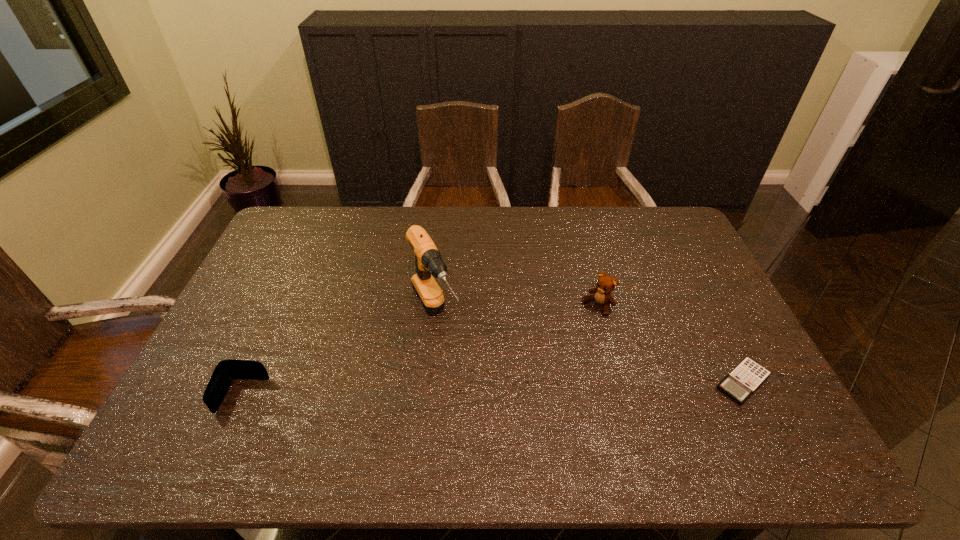
Find the location of a particular element. The image size is (960, 540). vacant area situated 0.070m at the tip of the third object from right to left is located at coordinates (456, 368).

The height and width of the screenshot is (540, 960). Identify the location of blank space located at the tip of the third object from right to left. coord(464,382).

This screenshot has height=540, width=960. In order to click on vacant space located 0.110m on the front-facing side of the teddy bear in this screenshot , I will do `click(567, 334)`.

Where is `vacant region located 0.270m on the front-facing side of the teddy bear`? The image size is (960, 540). vacant region located 0.270m on the front-facing side of the teddy bear is located at coordinates (531, 368).

This screenshot has height=540, width=960. I want to click on free location located 0.380m on the front-facing side of the teddy bear, so click(x=503, y=394).

Image resolution: width=960 pixels, height=540 pixels. What are the coordinates of `wallet that is at the near edge` in the screenshot? It's located at (226, 370).

Where is `calculator situated at the near edge`? The height and width of the screenshot is (540, 960). calculator situated at the near edge is located at coordinates (747, 376).

Find the location of a particular element. object that is positioned at the left edge is located at coordinates (226, 370).

Where is `object positioned at the right edge`? The width and height of the screenshot is (960, 540). object positioned at the right edge is located at coordinates (747, 376).

Identify the location of object at the near left corner. This screenshot has width=960, height=540. (226, 370).